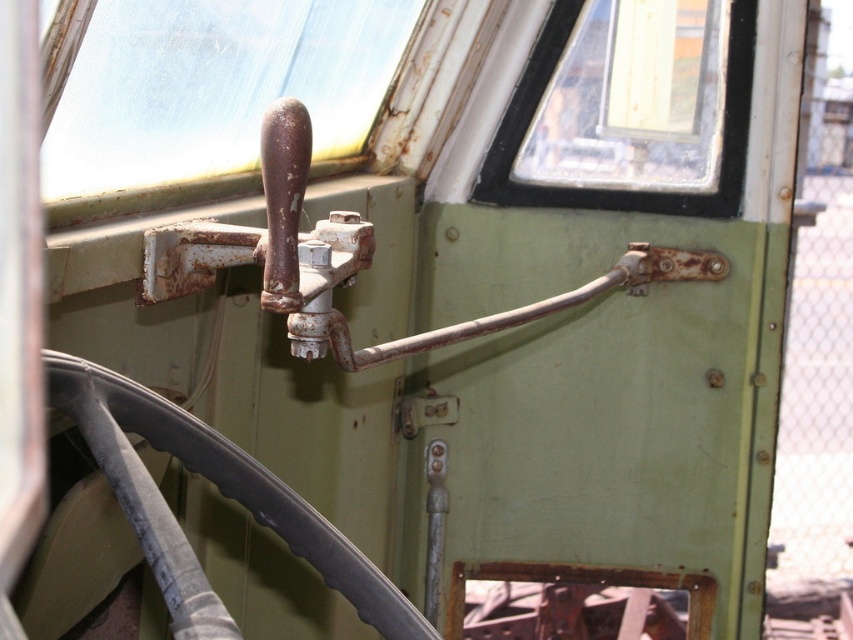
You are a mechanic working on an old vehicle. You need to locate the transparent plastic handle at upper center and the transparent glass window at upper center. Which one is positioned to the left of the other?

The transparent plastic handle at upper center is to the left of transparent glass window at upper center.

You are a mechanic inspecting the vehicle interior. You notice two controls at the upper center area. The transparent plastic handle at upper center and the transparent glass window at upper center. Which one is bigger in size?

The transparent plastic handle at upper center is larger in size compared to the transparent glass window at upper center.

You are a mechanic inspecting the vehicle interior. You notice two controls at the upper center area. Which one is narrower between the transparent plastic handle at upper center and the transparent glass window at upper center?

The transparent plastic handle at upper center is narrower than the transparent glass window at upper center as per the description.